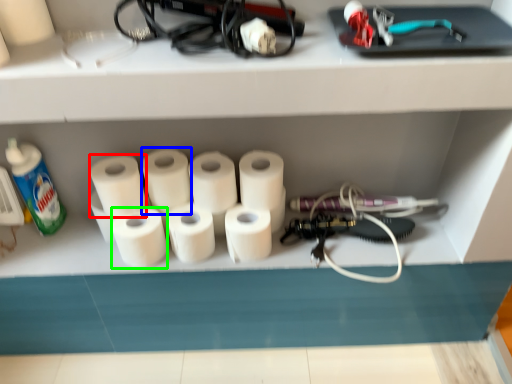
Question: Based on their relative distances, which object is nearer to toilet paper (highlighted by a red box)? Choose from toilet paper (highlighted by a blue box) and toilet paper (highlighted by a green box).

Choices:
 (A) toilet paper
 (B) toilet paper

Answer: (A)